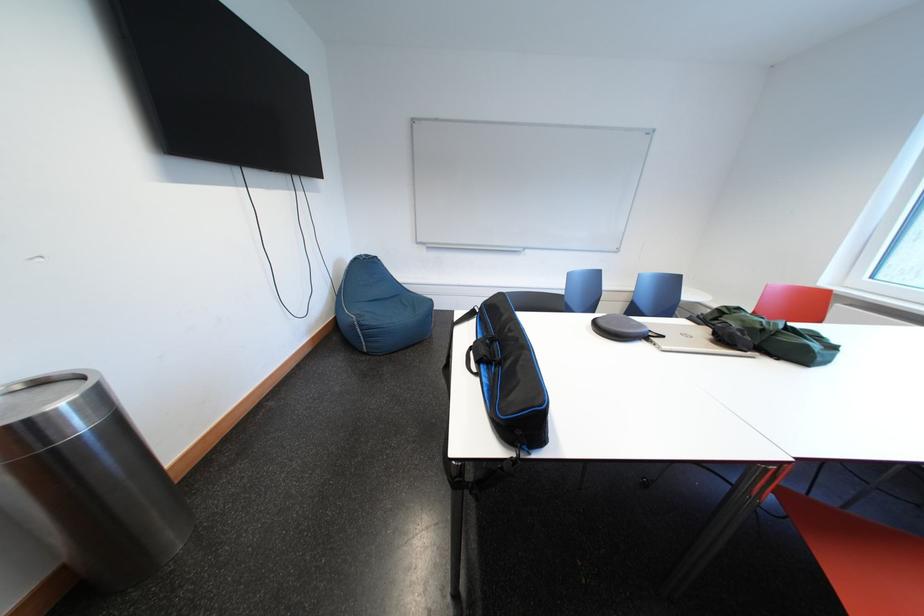
The image size is (924, 616). What do you see at coordinates (471, 360) in the screenshot?
I see `the black bag handle` at bounding box center [471, 360].